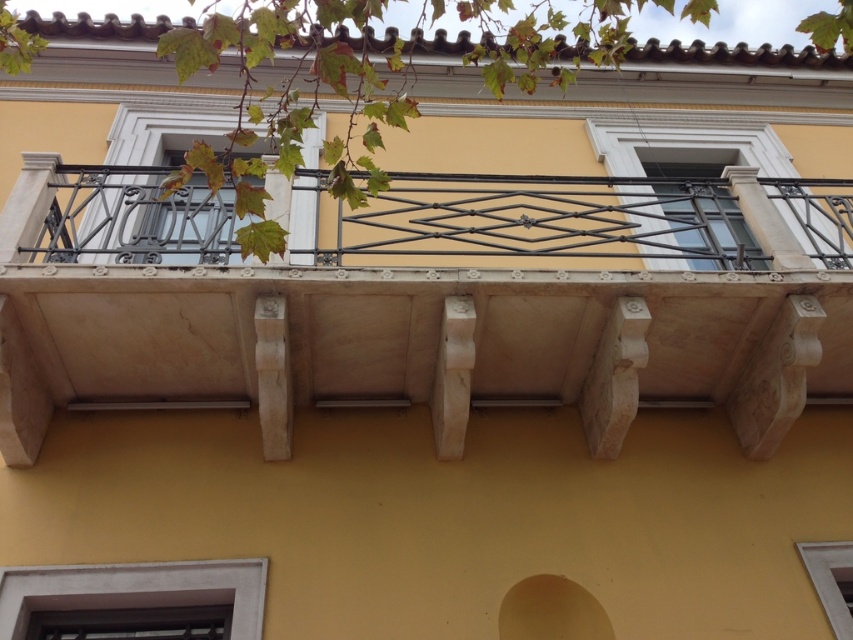
Between white marble balcony at center and metallic wrought iron at center, which one has more height?

white marble balcony at center is taller.

Can you confirm if white marble balcony at center is positioned to the right of metallic wrought iron at center?

Correct, you'll find white marble balcony at center to the right of metallic wrought iron at center.

Which is behind, point (567, 394) or point (173, 212)?

Point (567, 394)

Where is `white marble balcony at center`? This screenshot has height=640, width=853. white marble balcony at center is located at coordinates (430, 339).

Looking at this image, which of these two, white marble balcony at center or clear glass window at center, stands taller?

white marble balcony at center

Is white marble balcony at center bigger than clear glass window at center?

Indeed, white marble balcony at center has a larger size compared to clear glass window at center.

What do you see at coordinates (430, 339) in the screenshot? Image resolution: width=853 pixels, height=640 pixels. I see `white marble balcony at center` at bounding box center [430, 339].

Locate an element on the screen. white marble balcony at center is located at coordinates tap(430, 339).

Based on the photo, is metallic wrought iron at center shorter than white matte window at lower center?

In fact, metallic wrought iron at center may be taller than white matte window at lower center.

Between metallic wrought iron at center and white matte window at lower center, which one is positioned higher?

Positioned higher is metallic wrought iron at center.

Where is `metallic wrought iron at center`? The width and height of the screenshot is (853, 640). metallic wrought iron at center is located at coordinates (190, 218).

You are a GUI agent. You are given a task and a screenshot of the screen. Output one action in this format:
    pyautogui.click(x=<x>, y=<y>)
    Task: Click on the metallic wrought iron at center
    The width and height of the screenshot is (853, 640).
    Given the screenshot: What is the action you would take?
    pyautogui.click(x=190, y=218)